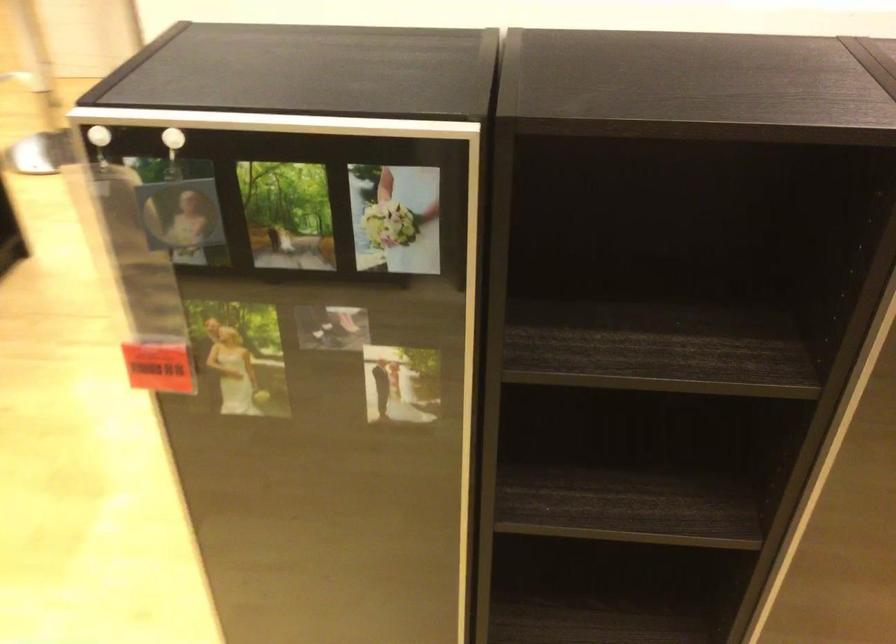
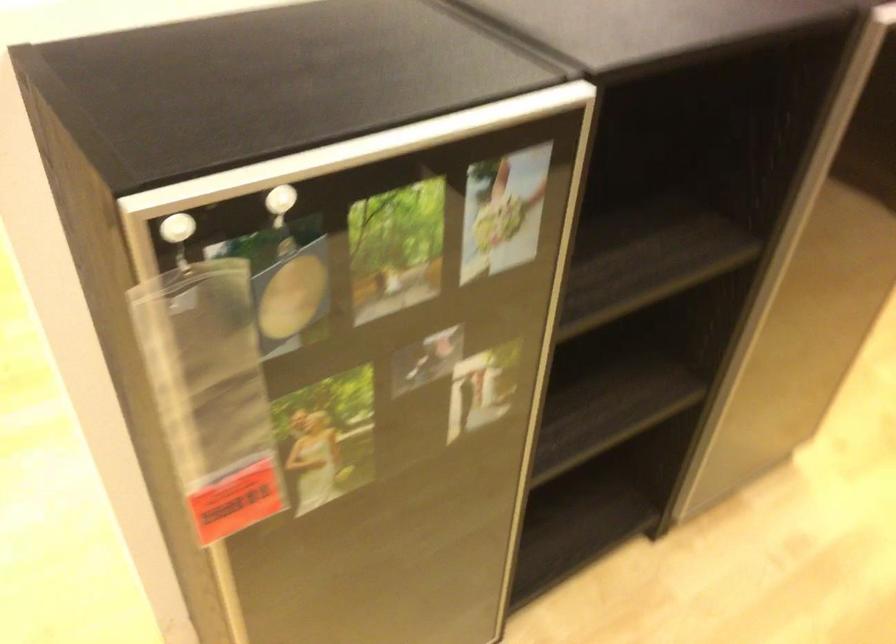
In the second image, find the point that corresponds to point 179,138 in the first image.

(280, 203)